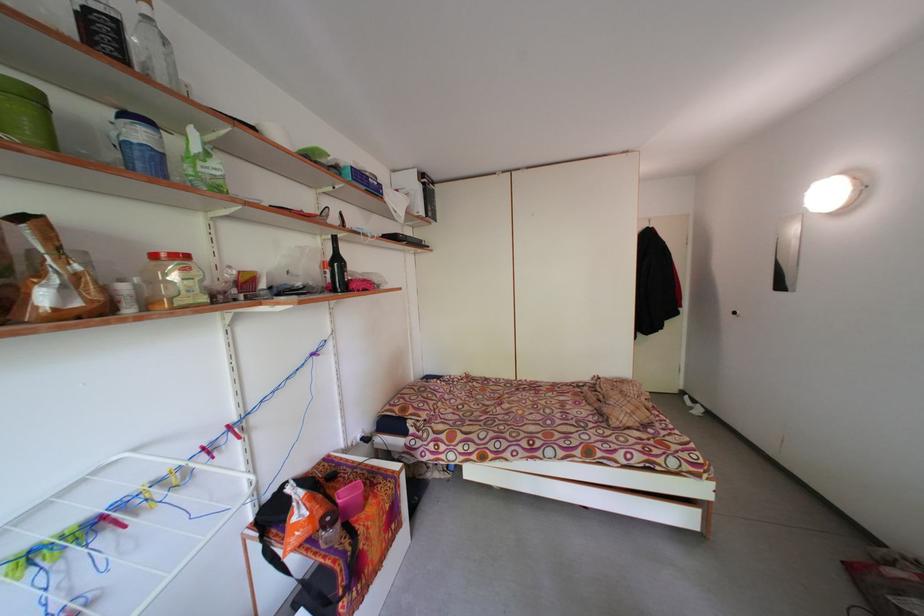
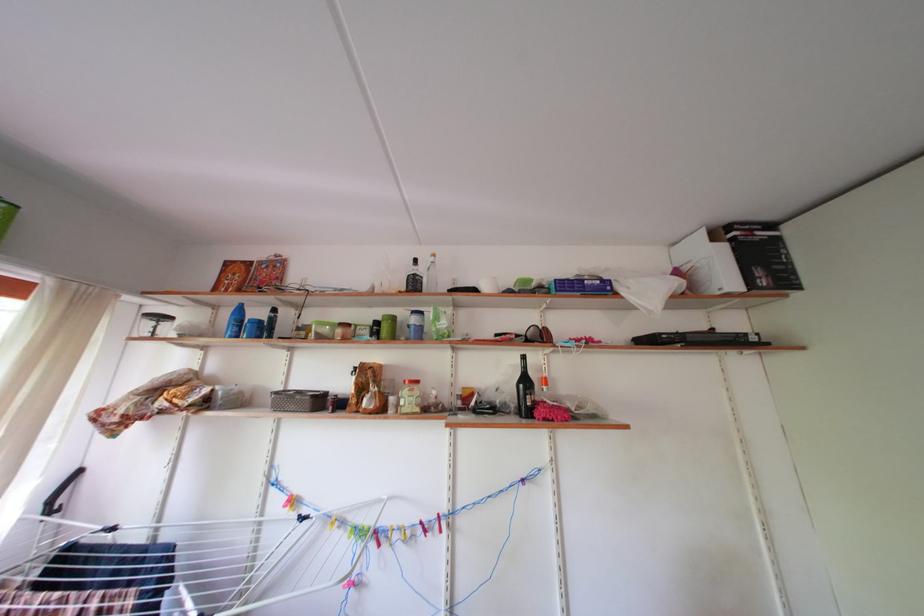
Locate, in the second image, the point that corresponds to pixel 438 216 in the first image.

(768, 278)